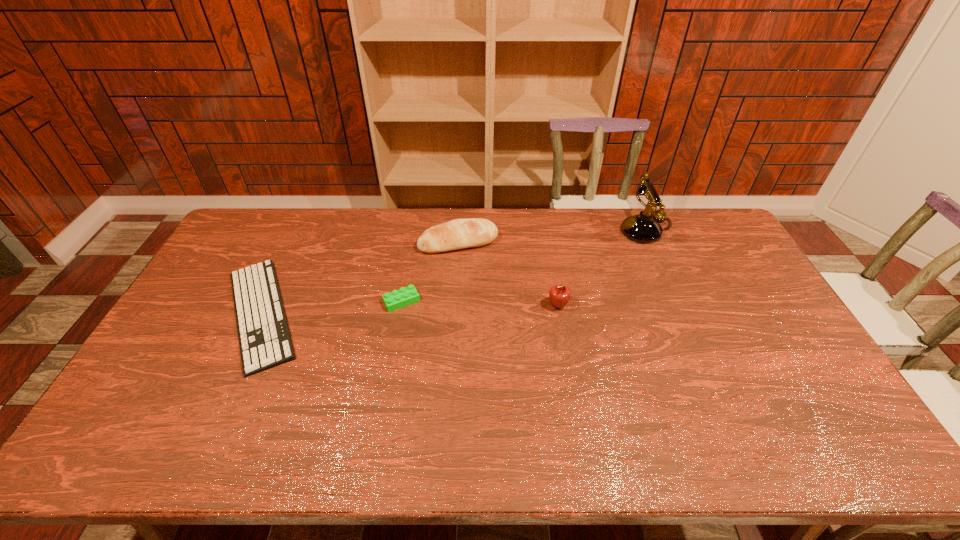
Where is `the rightmost object`? The width and height of the screenshot is (960, 540). the rightmost object is located at coordinates (643, 228).

This screenshot has height=540, width=960. Identify the location of telephone. (643, 228).

The image size is (960, 540). Identify the location of bread. click(x=456, y=234).

Image resolution: width=960 pixels, height=540 pixels. Find the location of `apple`. apple is located at coordinates (559, 295).

What are the coordinates of `the fourth tallest object` in the screenshot? It's located at (403, 297).

Locate an element on the screen. The width and height of the screenshot is (960, 540). the shortest object is located at coordinates (264, 338).

Where is `computer keyboard`? This screenshot has width=960, height=540. computer keyboard is located at coordinates (264, 338).

At what (x,y) coordinates should I click in order to perform the action: click on vacant position located 0.160m on the dial of the rightmost object. Please return your answer as a coordinate pair (x, y). Looking at the image, I should click on click(578, 230).

Locate an element on the screen. The image size is (960, 540). free space located on the dial of the rightmost object is located at coordinates (608, 230).

Where is `free spot located 0.250m on the dial of the rightmost object`? free spot located 0.250m on the dial of the rightmost object is located at coordinates (554, 230).